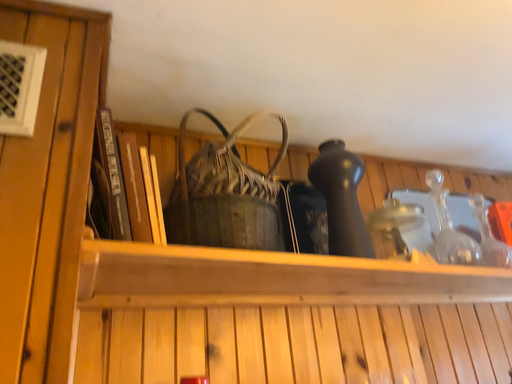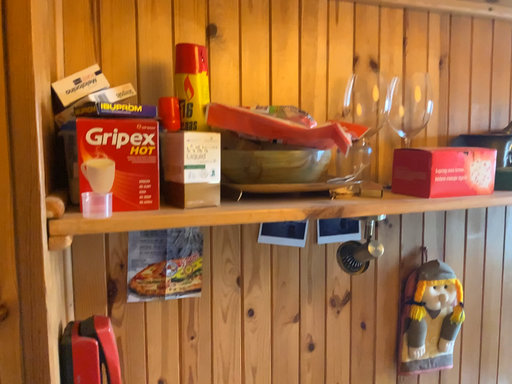
Question: Which way did the camera rotate in the video?

Choices:
 (A) rotated upward
 (B) rotated downward

Answer: (B)